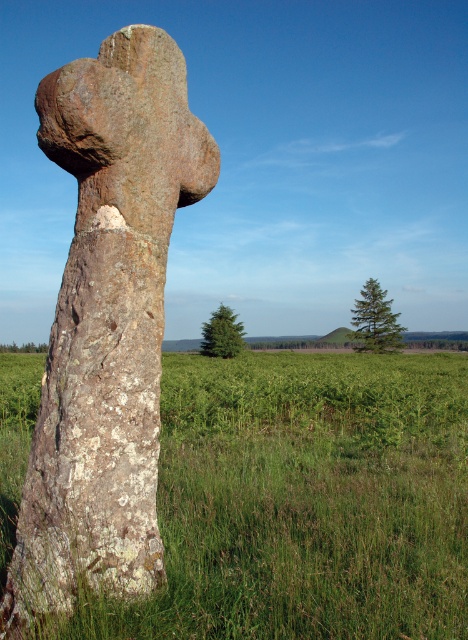
Question: Which point is farther to the camera?

Choices:
 (A) lichen-covered stone cross at center
 (B) green grassy at center

Answer: (A)

Question: Can you confirm if green grassy at center is positioned to the right of lichen-covered stone cross at center?

Choices:
 (A) no
 (B) yes

Answer: (A)

Question: Does green grassy at center appear over lichen-covered stone cross at center?

Choices:
 (A) yes
 (B) no

Answer: (B)

Question: Is green grassy at center behind lichen-covered stone cross at center?

Choices:
 (A) yes
 (B) no

Answer: (B)